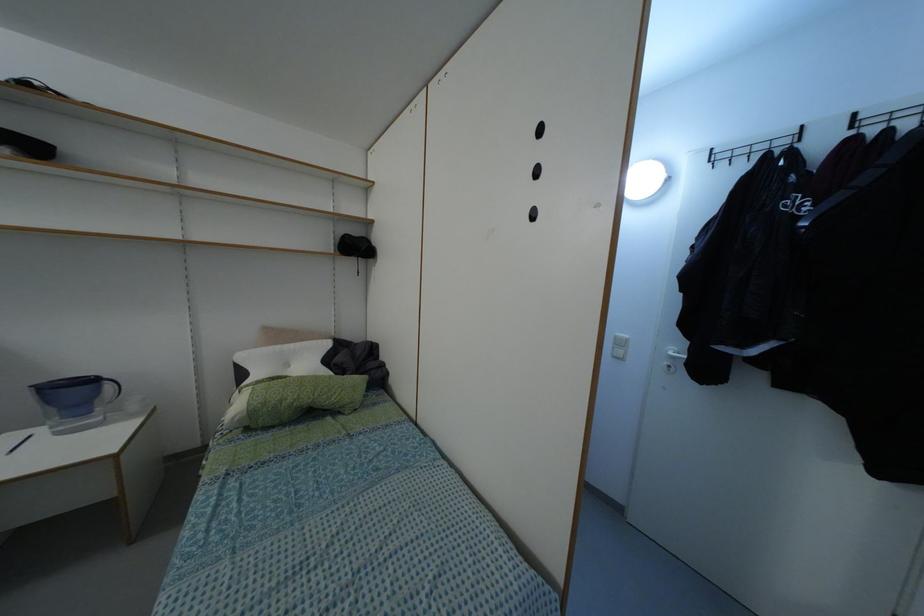
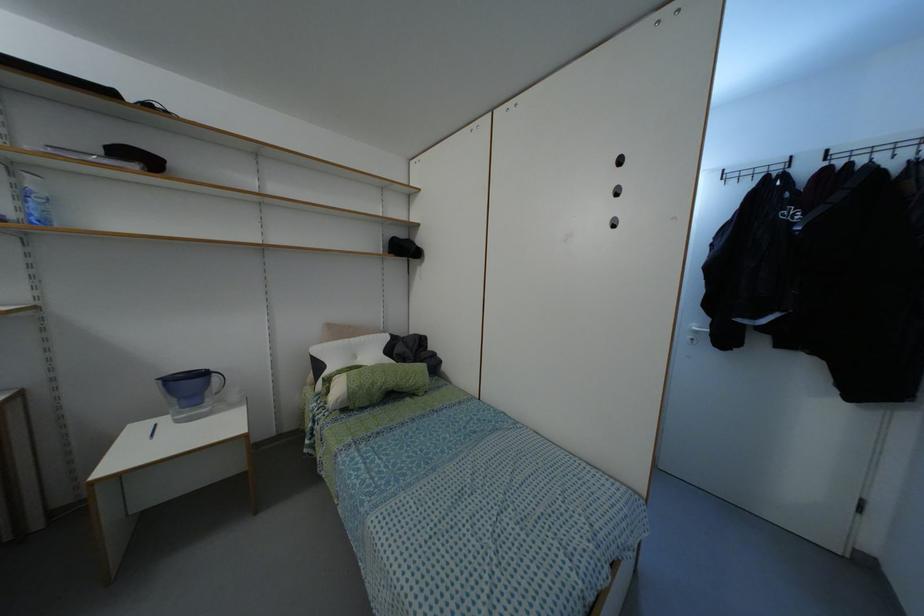
Locate, in the second image, the point that corresponds to the point at 276,346 in the first image.

(345, 339)